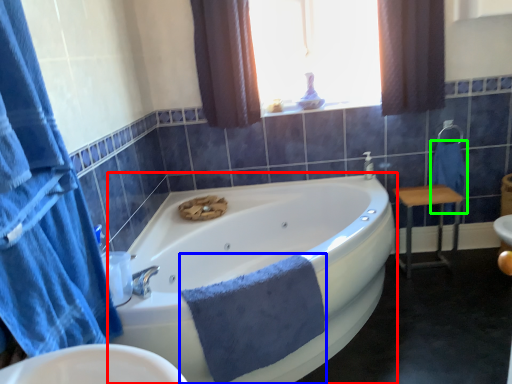
Question: Based on their relative distances, which object is farther from bathtub (highlighted by a red box)? Choose from bath towel (highlighted by a blue box) and bath towel (highlighted by a green box).

Choices:
 (A) bath towel
 (B) bath towel

Answer: (B)